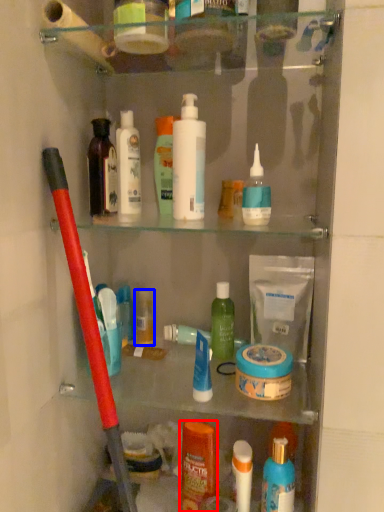
Question: Which point is further to the camera, toiletry (highlighted by a red box) or toiletry (highlighted by a blue box)?

Choices:
 (A) toiletry
 (B) toiletry

Answer: (B)